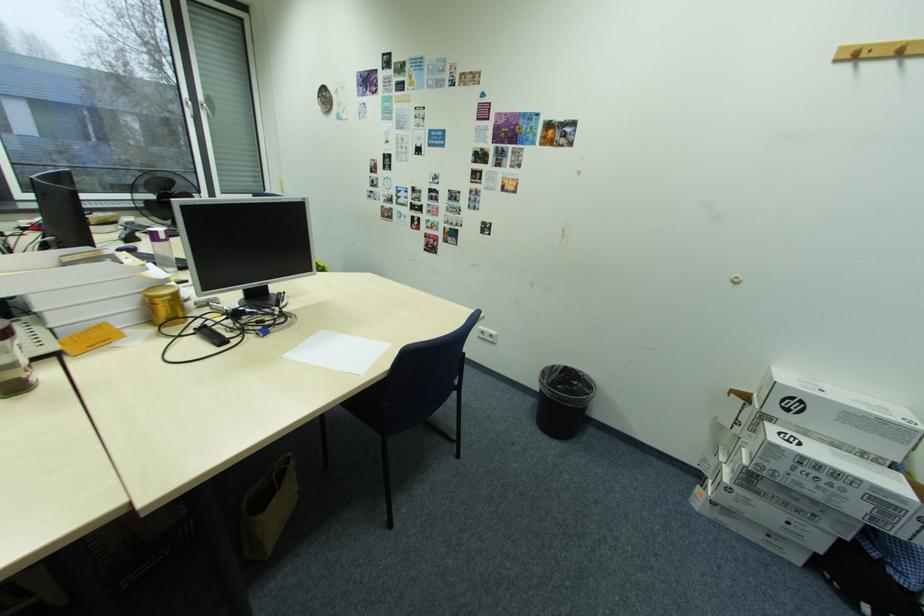
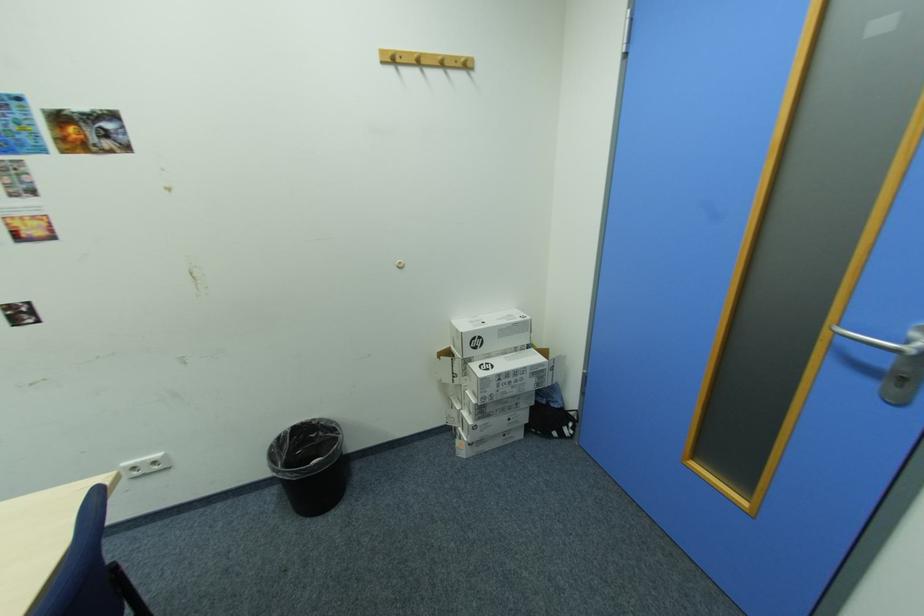
Locate, in the second image, the point that corresponds to pixel 752 461 in the first image.

(481, 400)